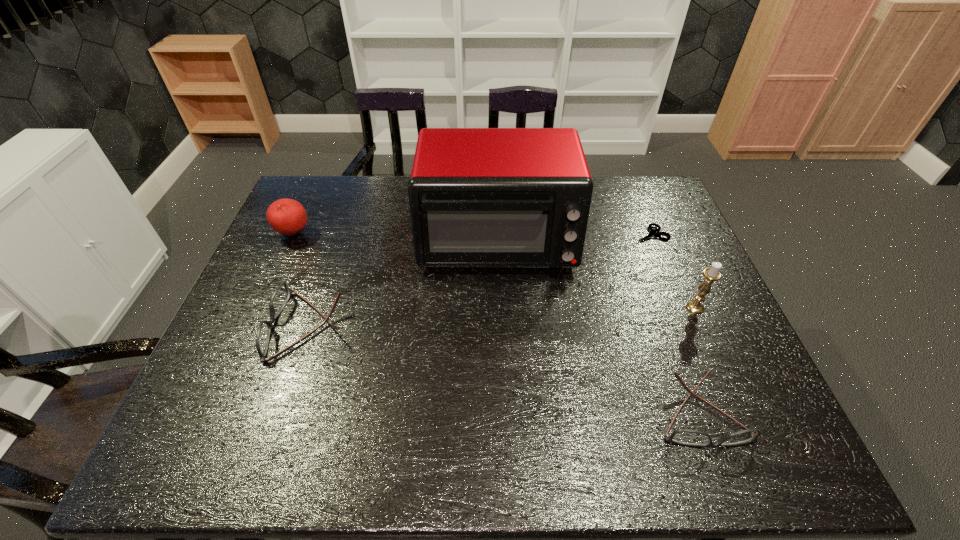
Locate an element on the screen. free spot between the nearer spectacles and the third object from left to right is located at coordinates (598, 326).

Where is `vacant region between the candle holder and the right spectacles`? Image resolution: width=960 pixels, height=540 pixels. vacant region between the candle holder and the right spectacles is located at coordinates (697, 360).

At what (x,y) coordinates should I click in order to perform the action: click on free point between the fifth shortest object and the left spectacles. Please return your answer as a coordinate pair (x, y). This screenshot has height=540, width=960. Looking at the image, I should click on (502, 317).

In order to click on vacant region between the third tallest object and the toaster oven in this screenshot , I will do `click(395, 237)`.

I want to click on unoccupied position between the shortest object and the taller spectacles, so click(x=480, y=280).

Locate an element on the screen. free space between the fourth object from right to left and the fourth shortest object is located at coordinates (395, 237).

You are a GUI agent. You are given a task and a screenshot of the screen. Output one action in this format:
    pyautogui.click(x=<x>, y=<y>)
    Task: Click on the vacant area that lies between the apple and the toaster oven
    Image resolution: width=960 pixels, height=540 pixels.
    Given the screenshot: What is the action you would take?
    pyautogui.click(x=395, y=237)

The image size is (960, 540). In order to click on object that is the third nearest to the toaster oven in this screenshot , I will do `click(711, 274)`.

Identify which object is located as the nearest to the nearer spectacles. Please provide its 2D coordinates. Your answer should be formatted as a tuple, i.e. [(x, y)], where the tuple contains the x and y coordinates of a point satisfying the conditions above.

[(711, 274)]

Identify the location of vacant area that satisfies the following two spatial constraints: 1. on the front-facing side of the toaster oven; 2. on the front-facing side of the farther spectacles. The image size is (960, 540). (500, 326).